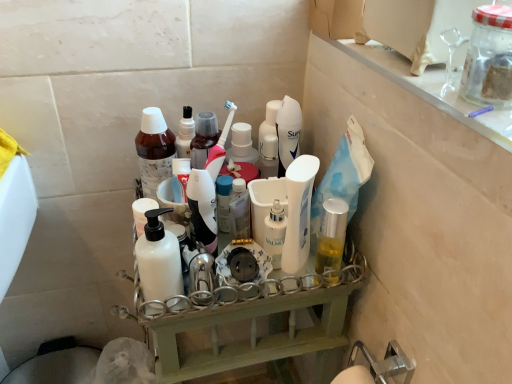
Question: Does white plastic shelf at center appear on the right side of clear glass shelf at upper right?

Choices:
 (A) yes
 (B) no

Answer: (B)

Question: From a real-world perspective, is white plastic shelf at center positioned under clear glass shelf at upper right based on gravity?

Choices:
 (A) yes
 (B) no

Answer: (A)

Question: Is white plastic shelf at center outside clear glass shelf at upper right?

Choices:
 (A) yes
 (B) no

Answer: (A)

Question: Can you confirm if white plastic shelf at center is bigger than clear glass shelf at upper right?

Choices:
 (A) yes
 (B) no

Answer: (A)

Question: From the image's perspective, is white plastic shelf at center under clear glass shelf at upper right?

Choices:
 (A) yes
 (B) no

Answer: (A)

Question: Considering the positions of white glossy lotion at center, acting as the 1th toiletry starting from the right, and white glossy lotion at center in the image, is white glossy lotion at center, acting as the 1th toiletry starting from the right, taller or shorter than white glossy lotion at center?

Choices:
 (A) tall
 (B) short

Answer: (B)

Question: Is white glossy lotion at center, the 2th toiletry viewed from the left, inside the boundaries of white glossy lotion at center, or outside?

Choices:
 (A) inside
 (B) outside

Answer: (B)

Question: Visually, is white glossy lotion at center, acting as the 1th toiletry starting from the right, positioned to the left or to the right of white glossy lotion at center?

Choices:
 (A) left
 (B) right

Answer: (A)

Question: Considering the positions of white glossy lotion at center, the 2th toiletry viewed from the left, and white glossy lotion at center in the image, is white glossy lotion at center, the 2th toiletry viewed from the left, wider or thinner than white glossy lotion at center?

Choices:
 (A) thin
 (B) wide

Answer: (B)

Question: From the image's perspective, is white matte bottle at center, marked as the second bottle in a back-to-front arrangement, above or below clear glass shelf at upper right?

Choices:
 (A) above
 (B) below

Answer: (B)

Question: Considering the positions of white matte bottle at center, which ranks as the first bottle in bottom-to-top order, and clear glass shelf at upper right in the image, is white matte bottle at center, which ranks as the first bottle in bottom-to-top order, wider or thinner than clear glass shelf at upper right?

Choices:
 (A) thin
 (B) wide

Answer: (A)

Question: Is white matte bottle at center, arranged as the 2th bottle when viewed from the top, spatially inside clear glass shelf at upper right, or outside of it?

Choices:
 (A) outside
 (B) inside

Answer: (A)

Question: In terms of size, does white matte bottle at center, marked as the second bottle in a back-to-front arrangement, appear bigger or smaller than clear glass shelf at upper right?

Choices:
 (A) big
 (B) small

Answer: (B)

Question: Looking at the image, does brown matte bottle at center, the first bottle in the top-to-bottom sequence, seem bigger or smaller compared to white matte bottle at center, which ranks as the first bottle in bottom-to-top order?

Choices:
 (A) small
 (B) big

Answer: (B)

Question: Looking at their shapes, would you say brown matte bottle at center, which is the second bottle from front to back, is wider or thinner than white matte bottle at center, marked as the second bottle in a back-to-front arrangement?

Choices:
 (A) wide
 (B) thin

Answer: (A)